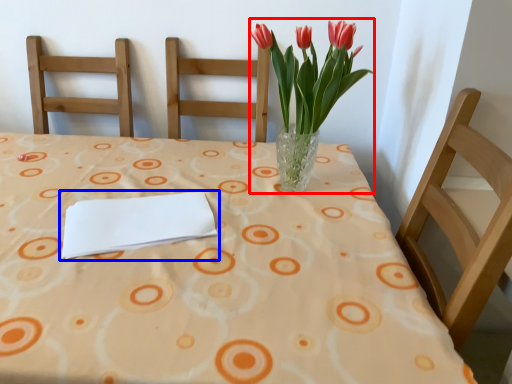
Question: Which of the following is the farthest to the observer, floral arrangement (highlighted by a red box) or journal (highlighted by a blue box)?

Choices:
 (A) floral arrangement
 (B) journal

Answer: (A)